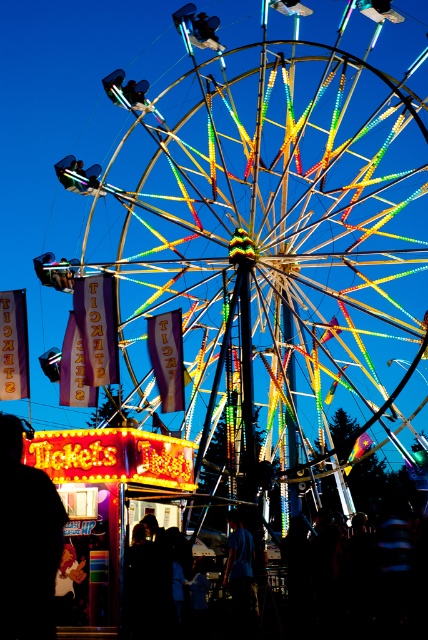
Question: Does blue fabric shirt at center lie in front of matte black figure at lower left?

Choices:
 (A) no
 (B) yes

Answer: (A)

Question: Based on their relative distances, which object is farther from the matte black figure at lower left?

Choices:
 (A) blue fabric shirt at center
 (B) metallic silver helmet at center

Answer: (B)

Question: Which object is the farthest from the metallic silver helmet at center?

Choices:
 (A) matte black figure at lower left
 (B) silhouette figure at lower left
 (C) blue fabric shirt at center

Answer: (C)

Question: Estimate the real-world distances between objects in this image. Which object is farther from the matte black figure at lower left?

Choices:
 (A) silhouette figure at lower left
 (B) blue fabric shirt at center

Answer: (B)

Question: Is blue fabric shirt at center smaller than metallic silver helmet at center?

Choices:
 (A) no
 (B) yes

Answer: (A)

Question: Can you confirm if silhouette figure at lower left is wider than metallic silver helmet at center?

Choices:
 (A) yes
 (B) no

Answer: (A)